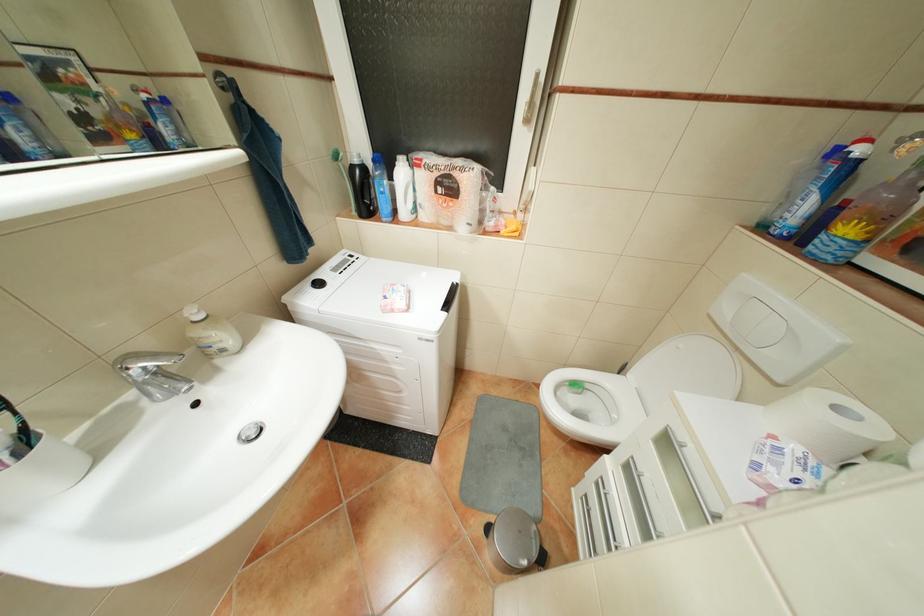
Where would you lift the faucet handle? Please return your answer as a coordinate pair (x, y).

(152, 374)